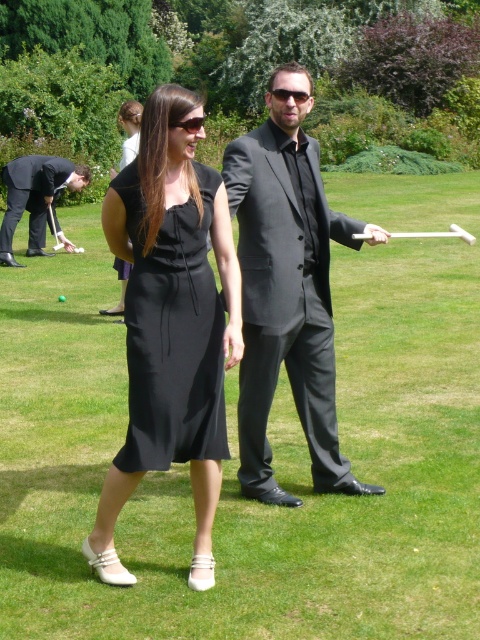
Question: Among these objects, which one is farthest from the camera?

Choices:
 (A) satin black dress at center
 (B) black suit at left
 (C) matte black suit at center
 (D) green grass at center

Answer: (B)

Question: Which object appears farthest from the camera in this image?

Choices:
 (A) green grass at center
 (B) black satin dress at center
 (C) satin black dress at center

Answer: (C)

Question: Does black satin dress at center have a smaller size compared to black suit at left?

Choices:
 (A) no
 (B) yes

Answer: (B)

Question: Does matte black suit at center have a smaller size compared to satin black dress at center?

Choices:
 (A) no
 (B) yes

Answer: (A)

Question: Does black satin dress at center appear over black suit at left?

Choices:
 (A) no
 (B) yes

Answer: (A)

Question: Which object is positioned closest to the matte black suit at center?

Choices:
 (A) black suit at left
 (B) green grass at center
 (C) black satin dress at center

Answer: (C)